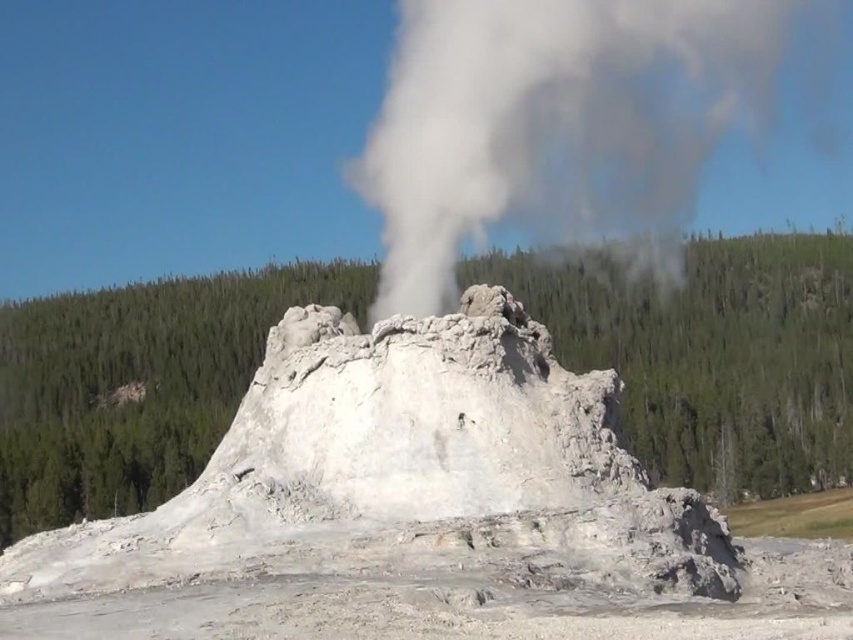
Which of these two, white rocky geyser at center or white vapor at center, stands taller?

white vapor at center is taller.

Is point (198, 554) more distant than point (508, 195)?

No, it is in front of (508, 195).

At what (x,y) coordinates should I click in order to perform the action: click on white rocky geyser at center. Please return your answer as a coordinate pair (x, y). Looking at the image, I should click on (405, 468).